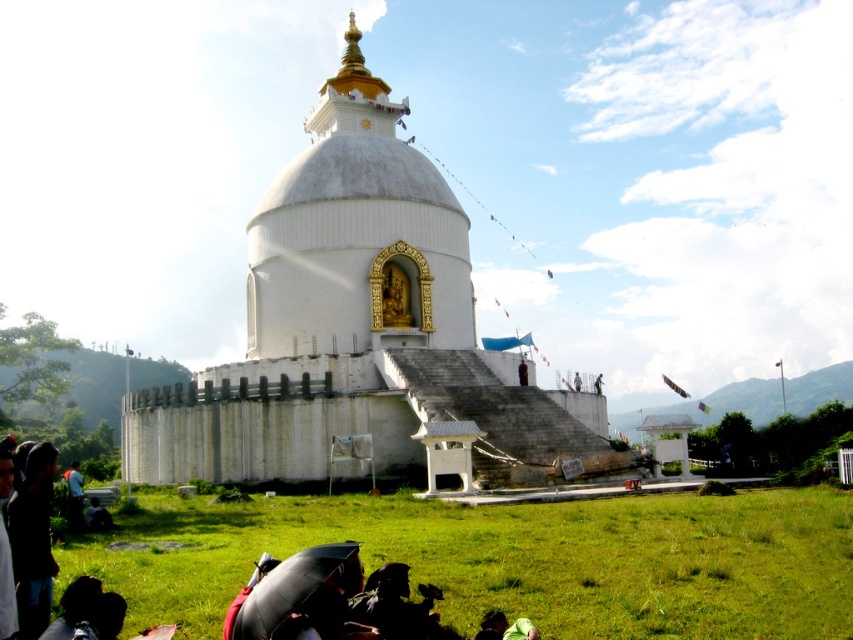
Is green grass at lower center positioned at the back of green fabric at lower center?

Yes, green grass at lower center is further from the viewer.

Between green grass at lower center and green fabric at lower center, which one appears on the right side from the viewer's perspective?

green grass at lower center

The height and width of the screenshot is (640, 853). What are the coordinates of `green grass at lower center` in the screenshot? It's located at (512, 560).

Is white stone stupa at center taller than green fabric at lower center?

Yes, white stone stupa at center is taller than green fabric at lower center.

What do you see at coordinates (361, 332) in the screenshot? I see `white stone stupa at center` at bounding box center [361, 332].

I want to click on white stone stupa at center, so click(x=361, y=332).

Between white stone stupa at center and green grass at lower center, which one has more height?

white stone stupa at center

Does white stone stupa at center come in front of green grass at lower center?

That is False.

Image resolution: width=853 pixels, height=640 pixels. Find the location of `white stone stupa at center`. white stone stupa at center is located at coordinates (361, 332).